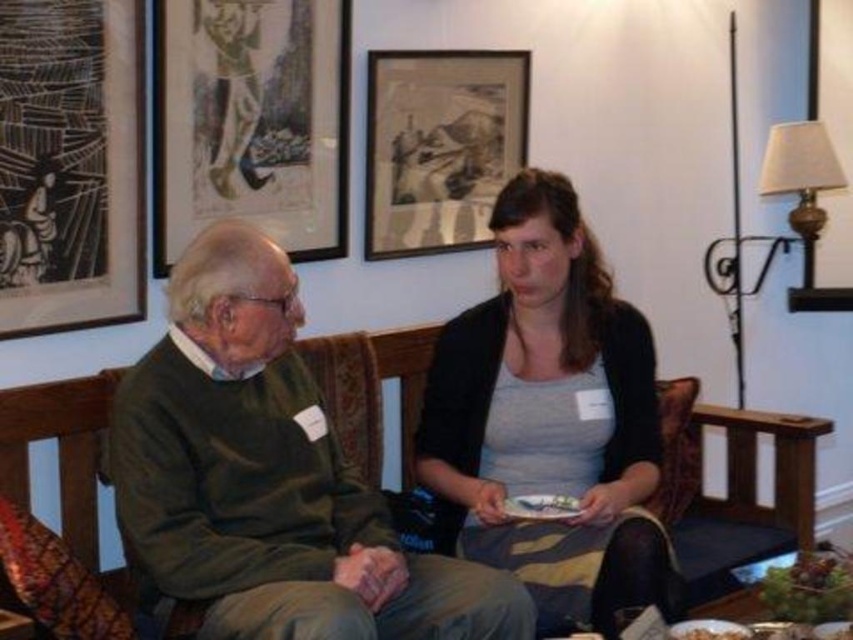
Does gray cotton shirt at center have a smaller size compared to white paper napkin at lower center?

No, gray cotton shirt at center is not smaller than white paper napkin at lower center.

How much distance is there between gray cotton shirt at center and white paper napkin at lower center?

11.92 inches

Is point (434, 362) behind point (514, 500)?

That is True.

The image size is (853, 640). What are the coordinates of `gray cotton shirt at center` in the screenshot? It's located at (549, 419).

Is green sweater at center taller than smooth brown bread at lower right?

Yes.

Which is in front, point (273, 609) or point (850, 576)?

Positioned in front is point (273, 609).

Where is `green sweater at center`? green sweater at center is located at coordinates (270, 477).

Describe the element at coordinates (70, 164) in the screenshot. The image size is (853, 640). I see `black paper picture frame at upper left` at that location.

Who is more distant from viewer, (67, 88) or (163, 20)?

The point (163, 20) is behind.

Identify the location of black paper picture frame at upper left. (70, 164).